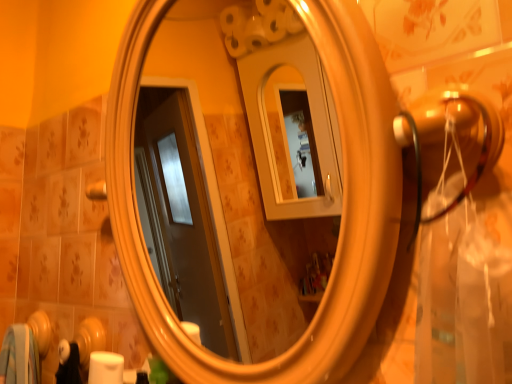
Describe the element at coordinates (105, 368) in the screenshot. The image size is (512, 384). I see `white matte toilet paper at lower left` at that location.

You are a GUI agent. You are given a task and a screenshot of the screen. Output one action in this format:
    pyautogui.click(x=<x>, y=<y>)
    Task: Click on the white matte toilet paper at lower left
    The height and width of the screenshot is (384, 512).
    Given the screenshot: What is the action you would take?
    pyautogui.click(x=105, y=368)

The height and width of the screenshot is (384, 512). What are the coordinates of `white matte toilet paper at lower left` in the screenshot? It's located at (105, 368).